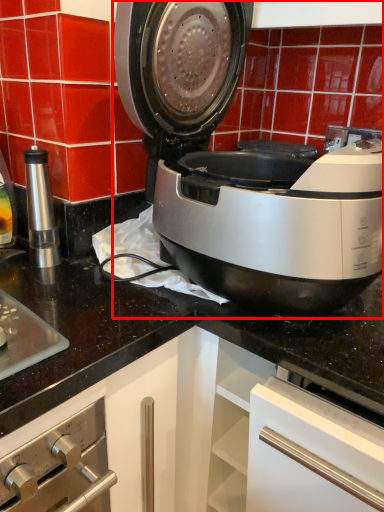
Question: From the image's perspective, what is the correct spatial positioning of home appliance (annotated by the red box) in reference to kitchen appliance?

Choices:
 (A) above
 (B) below

Answer: (A)